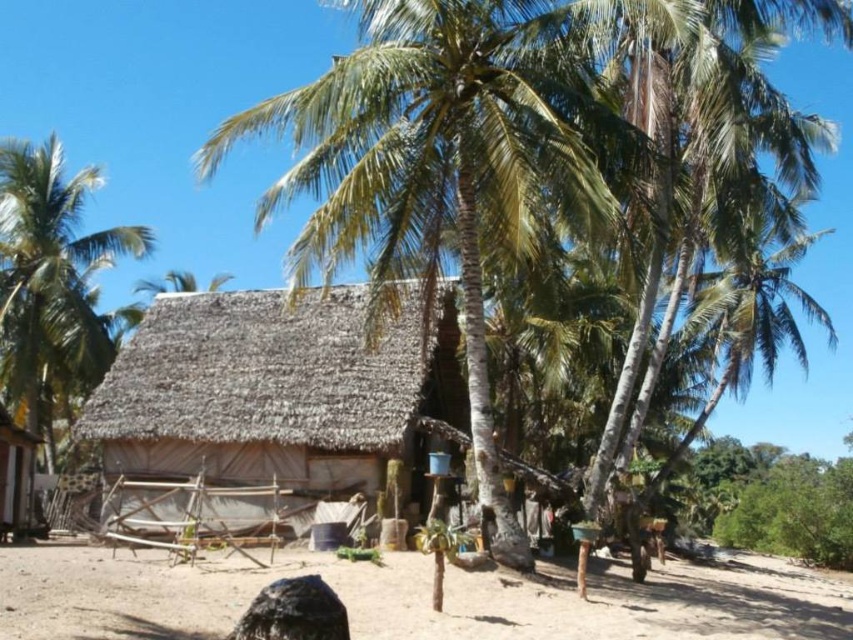
Question: Does green leafy coconut tree at center appear on the right side of green leafy palm tree at upper left?

Choices:
 (A) no
 (B) yes

Answer: (B)

Question: Among these objects, which one is farthest from the camera?

Choices:
 (A) thatched straw hut at center
 (B) brown sandy ground at lower center

Answer: (A)

Question: Is thatched straw hut at center to the right of brown sandy ground at lower center from the viewer's perspective?

Choices:
 (A) yes
 (B) no

Answer: (B)

Question: Estimate the real-world distances between objects in this image. Which object is farther from the thatched straw hut at center?

Choices:
 (A) brown sandy ground at lower center
 (B) matte brown hut at lower left
 (C) green leafy palm tree at upper left
 (D) green leafy coconut tree at center

Answer: (C)

Question: Among these points, which one is farthest from the camera?

Choices:
 (A) (438, 64)
 (B) (16, 204)
 (C) (439, 634)
 (D) (264, 438)

Answer: (B)

Question: Where is green leafy coconut tree at center located in relation to green leafy palm tree at upper left in the image?

Choices:
 (A) left
 (B) right

Answer: (B)